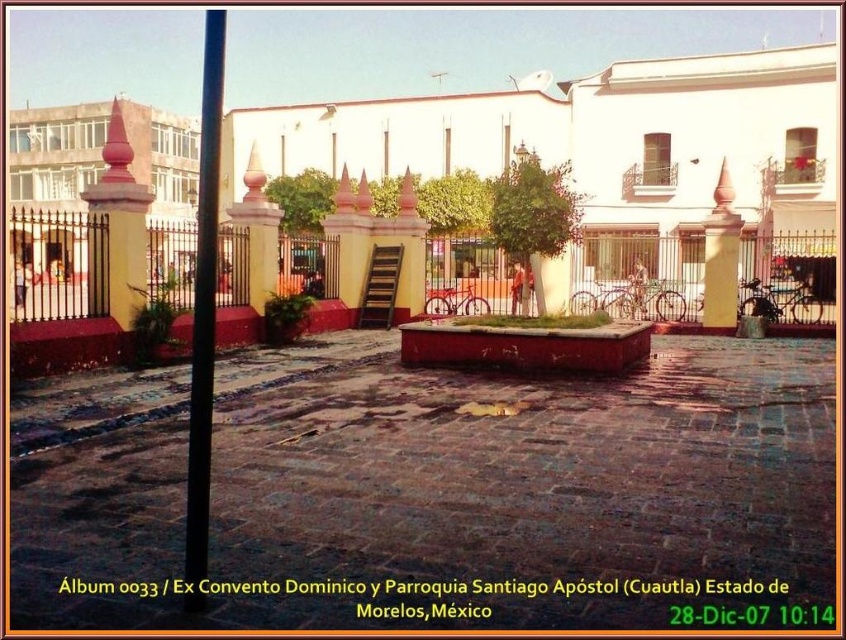
Question: Can you confirm if black smooth pole at left is wider than red painted stone pillar at left?

Choices:
 (A) no
 (B) yes

Answer: (B)

Question: Which point is farther to the camera?

Choices:
 (A) (713, 212)
 (B) (195, 387)
 (C) (118, 304)

Answer: (A)

Question: Which object is positioned closest to the black smooth pole at left?

Choices:
 (A) red painted stone pillar at left
 (B) yellow matte pillar at center

Answer: (A)

Question: Can you confirm if black smooth pole at left is positioned below red painted stone pillar at left?

Choices:
 (A) no
 (B) yes

Answer: (A)

Question: Considering the relative positions of black smooth pole at left and yellow matte pillar at center in the image provided, where is black smooth pole at left located with respect to yellow matte pillar at center?

Choices:
 (A) right
 (B) left

Answer: (B)

Question: Among these points, which one is farthest from the camera?

Choices:
 (A) (724, 284)
 (B) (97, 179)

Answer: (B)